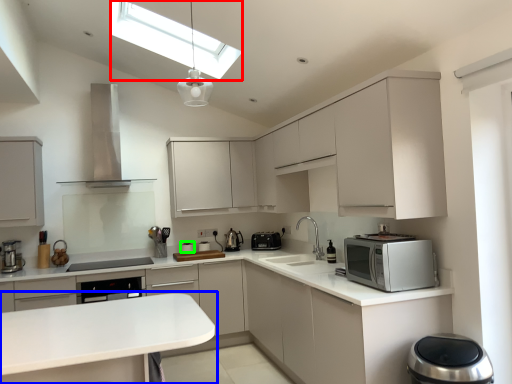
Question: Estimate the real-world distances between objects in this image. Which object is farther from lighting (highlighted by a red box), countertop (highlighted by a blue box) or appliance (highlighted by a green box)?

Choices:
 (A) countertop
 (B) appliance

Answer: (B)